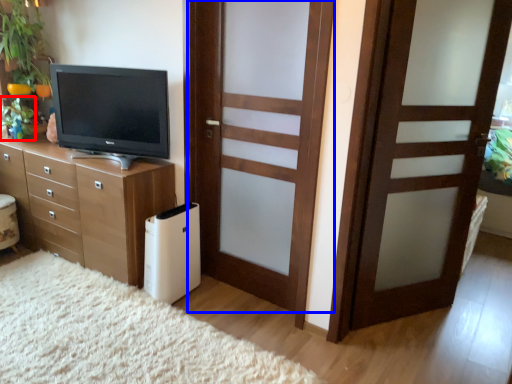
Question: Which object is closer to the camera taking this photo, plant (highlighted by a red box) or door (highlighted by a blue box)?

Choices:
 (A) plant
 (B) door

Answer: (B)